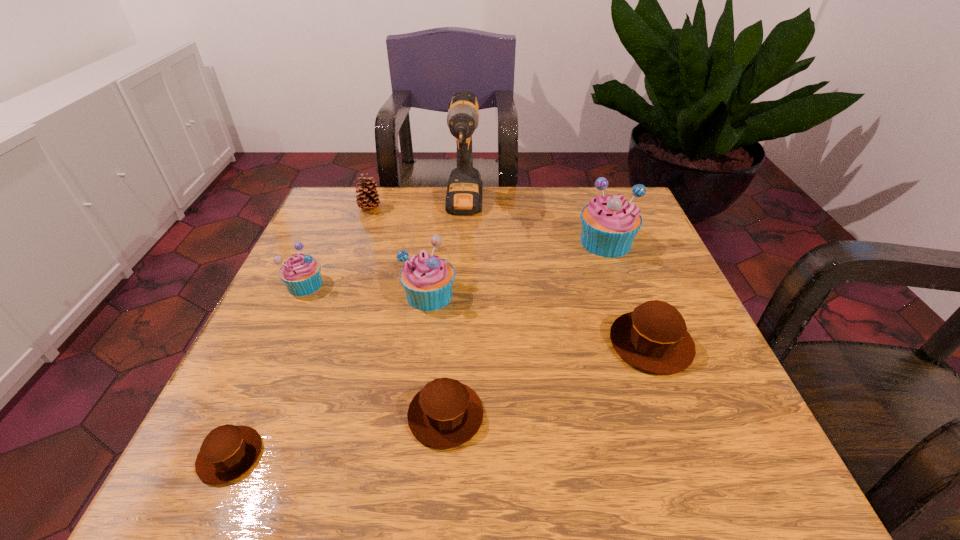
Identify the location of free location located on the right of the shortest muffin. This screenshot has width=960, height=540. (370, 455).

This screenshot has height=540, width=960. I want to click on drill located in the far edge section of the desktop, so click(x=464, y=191).

You are a GUI agent. You are given a task and a screenshot of the screen. Output one action in this format:
    pyautogui.click(x=<x>, y=<y>)
    Task: Click on the muffin located in the far edge section of the desktop
    
    Given the screenshot: What is the action you would take?
    pyautogui.click(x=609, y=224)

Where is `pinecone located at the far edge`? pinecone located at the far edge is located at coordinates (367, 199).

The width and height of the screenshot is (960, 540). In order to click on pinecone that is at the left edge in this screenshot , I will do `click(367, 199)`.

I want to click on object situated at the far left corner, so pos(367,199).

The width and height of the screenshot is (960, 540). Identify the location of object that is at the near left corner. (229, 451).

Identify the location of object located at the far right corner. This screenshot has width=960, height=540. (609, 224).

In the image, there is a desktop. Where is `vacant space at the far edge`? The image size is (960, 540). vacant space at the far edge is located at coordinates (431, 228).

This screenshot has height=540, width=960. What are the coordinates of `blank space at the near edge of the desktop` in the screenshot? It's located at (542, 483).